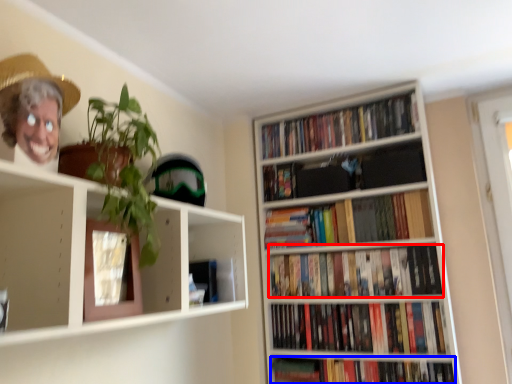
Question: Which object appears farthest to the camera in this image, book (highlighted by a red box) or book (highlighted by a blue box)?

Choices:
 (A) book
 (B) book

Answer: (A)